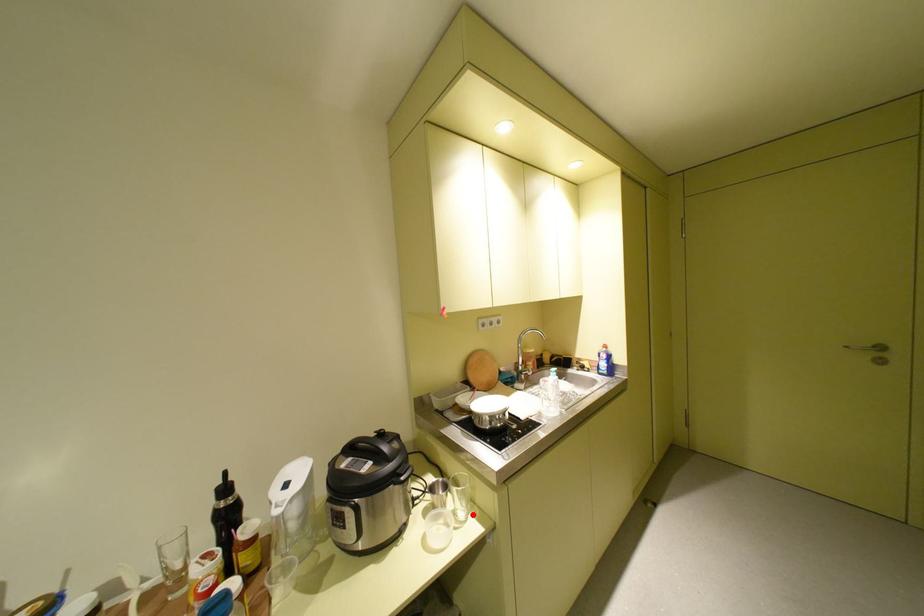
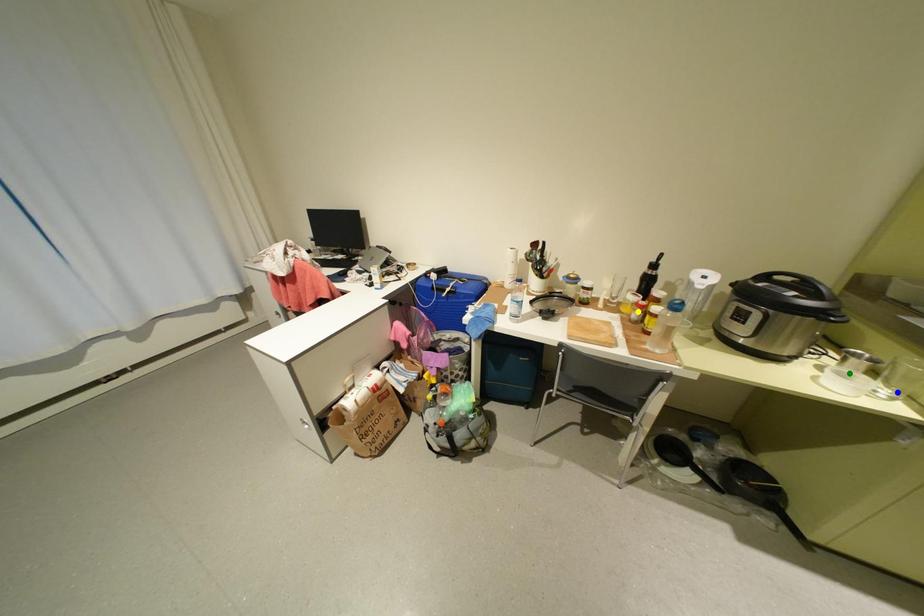
Question: I am providing you with two images of the same scene from different viewpoints. A red point is marked on the first image. You are given multiple points on the second image. Which mark in image 2 goes with the point in image 1?

Choices:
 (A) green point
 (B) yellow point
 (C) blue point

Answer: (C)